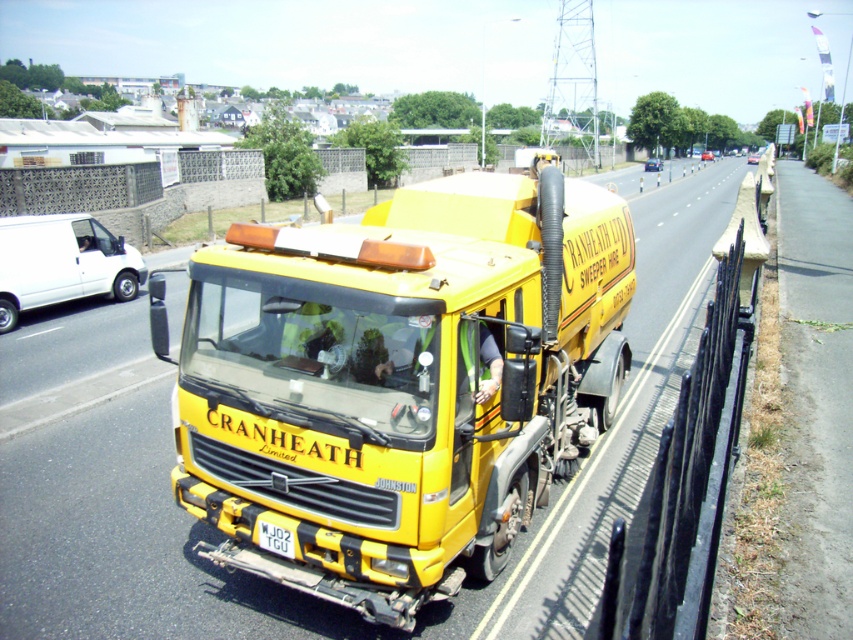
Consider the image. Between yellow matte truck at center and white plastic license plate at center, which one is positioned higher?

yellow matte truck at center is above.

Does yellow matte truck at center have a greater width compared to white plastic license plate at center?

Indeed, yellow matte truck at center has a greater width compared to white plastic license plate at center.

At what (x,y) coordinates should I click in order to perform the action: click on yellow matte truck at center. Please return your answer as a coordinate pair (x, y). Looking at the image, I should click on 399,381.